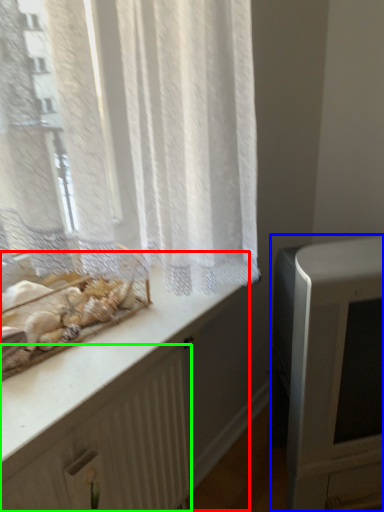
Question: Considering the real-world distances, which object is closest to counter (highlighted by a red box)? appliance (highlighted by a blue box) or radiator (highlighted by a green box).

Choices:
 (A) appliance
 (B) radiator

Answer: (B)